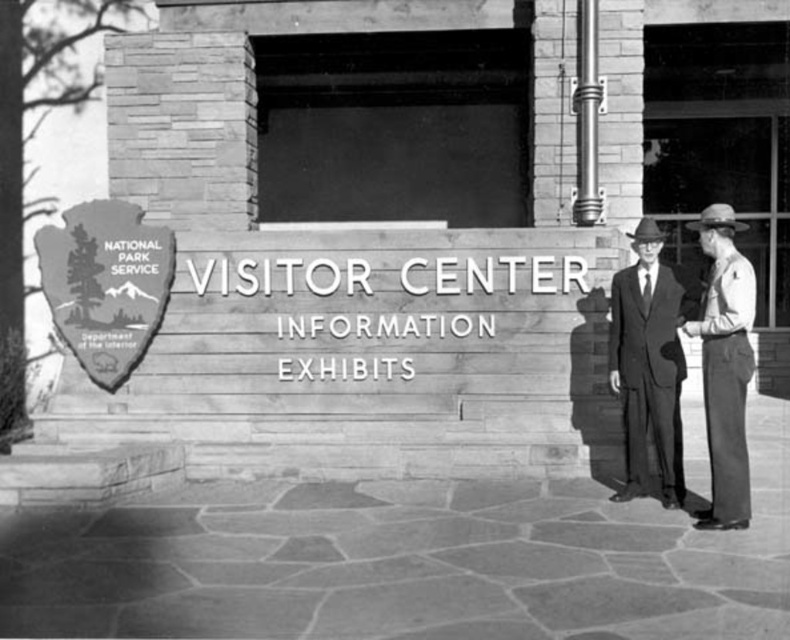
You are a park ranger who needs to place a new sign on the wall between the wooden shield at center and the smooth leather hat at right. Based on their current positions, where should the new sign be placed to ensure it is between them?

The wooden shield at center is positioned over the smooth leather hat at right, so the new sign should be placed below the wooden shield at center and above the smooth leather hat at right to be between them.

Consider the image. You are a park ranger who needs to place a smooth leather hat at right on top of the wooden shield at center. Can the hat fit on the shield without overhanging the edges?

The wooden shield at center might be wider than smooth leather hat at right, so there is a possibility that the hat can fit without overhanging the edges, but it is uncertain.

You are standing in front of the Visitor Center sign and notice a small point marked at coordinates (104, 284). Based on the scene description, can you determine what object this point is located on?

The point at coordinates (104, 284) is located on the wooden shield at center, which features a silhouette of a tree, mountains, and a forested area with the words NATIONAL PARK SERVICE inscribed above it.